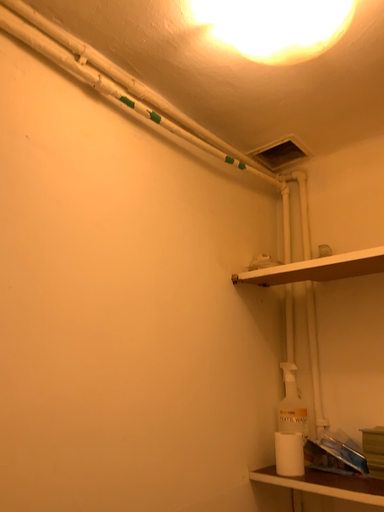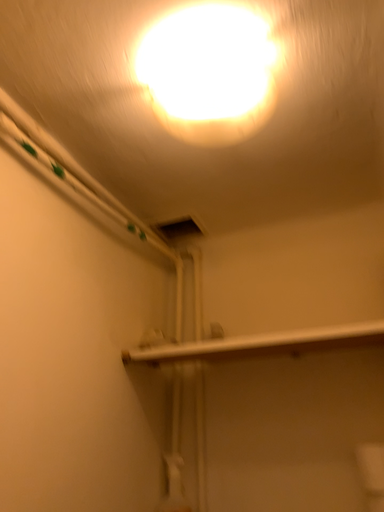
Question: How did the camera likely rotate when shooting the video?

Choices:
 (A) rotated upward
 (B) rotated downward

Answer: (A)